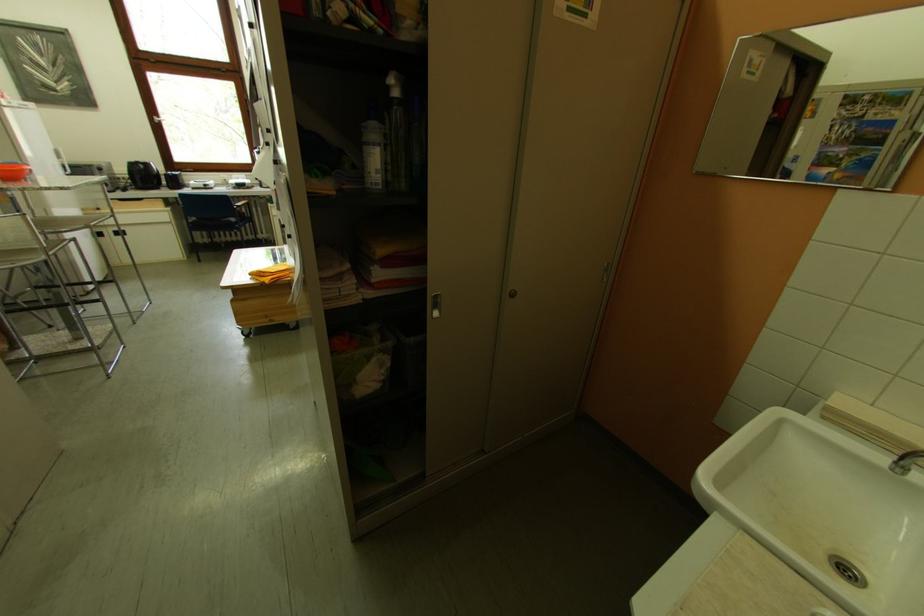
Find where to press the spray bottle trigger. Please return your answer as a coordinate pair (x, y).

(862, 508)